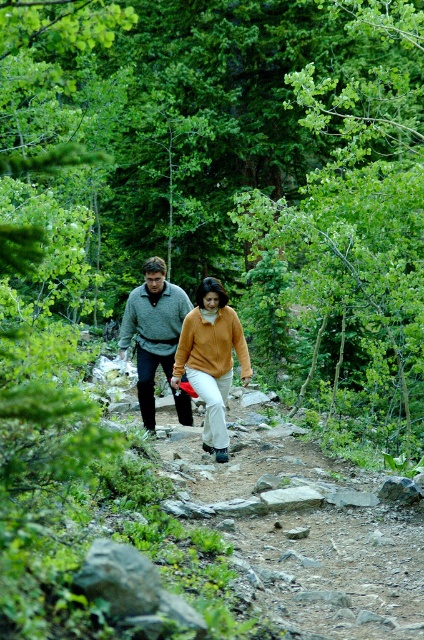
Consider the image. Does matte orange sweater at center have a smaller size compared to knit sweater at center?

Yes, matte orange sweater at center is smaller than knit sweater at center.

Does point (226, 323) come farther from viewer compared to point (190, 305)?

No, (226, 323) is in front of (190, 305).

Locate an element on the screen. The height and width of the screenshot is (640, 424). matte orange sweater at center is located at coordinates (212, 358).